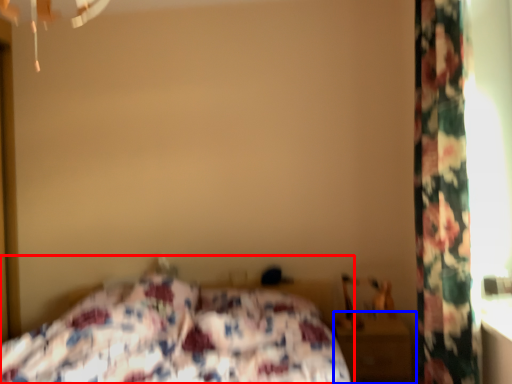
Question: Which object is closer to the camera taking this photo, bed (highlighted by a red box) or nightstand (highlighted by a blue box)?

Choices:
 (A) bed
 (B) nightstand

Answer: (A)